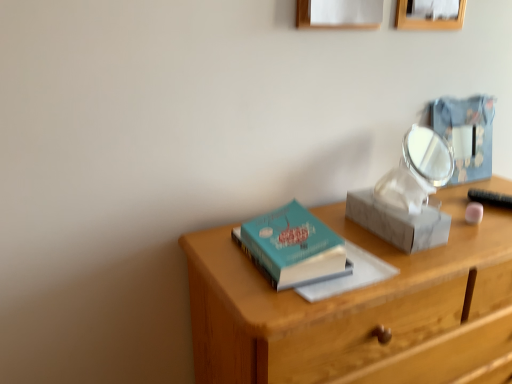
The image size is (512, 384). Find the location of `vacant area to the right of white marble shoe box at center-right`. vacant area to the right of white marble shoe box at center-right is located at coordinates (476, 235).